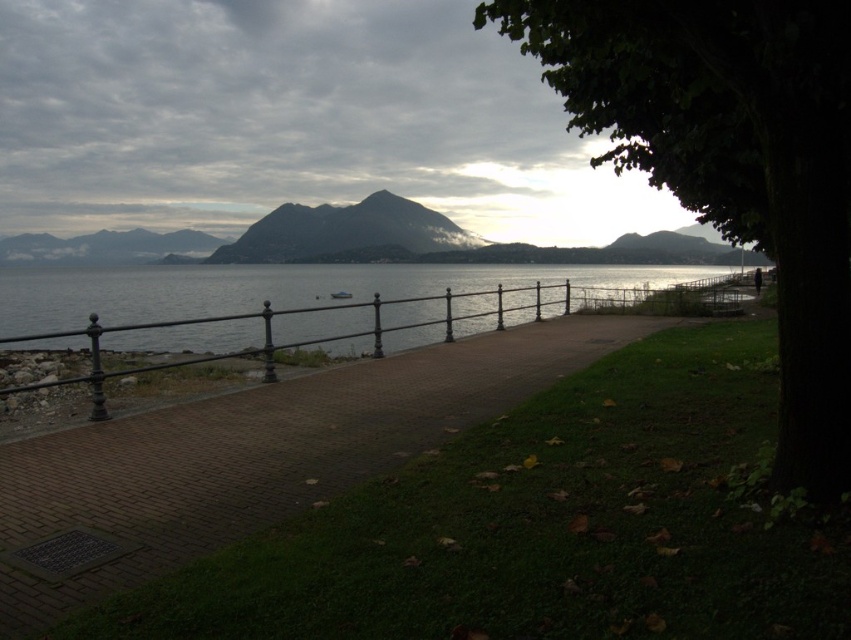
Question: Is green leafy tree at right smaller than brick paved path at center?

Choices:
 (A) no
 (B) yes

Answer: (A)

Question: Which point is farther from the camera taking this photo?

Choices:
 (A) (829, 288)
 (B) (570, 298)

Answer: (B)

Question: Which object is the farthest from the clear water at center?

Choices:
 (A) gray rocky mountain at center
 (B) brick paved path at center
 (C) green leafy tree at right

Answer: (B)

Question: Is green leafy tree at right to the left of clear water at center from the viewer's perspective?

Choices:
 (A) no
 (B) yes

Answer: (A)

Question: Which point is farther from the camera taking this photo?

Choices:
 (A) (709, 81)
 (B) (307, 483)

Answer: (B)

Question: Does brick paved path at center have a smaller size compared to gray rocky mountain at center?

Choices:
 (A) yes
 (B) no

Answer: (A)